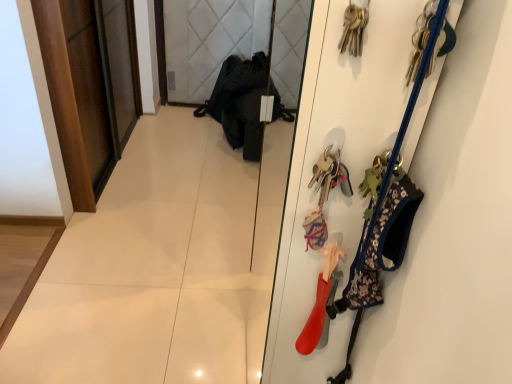
Question: From the image's perspective, is rubberized red boot at right, the first accessory positioned from the bottom, above dark wood door at left?

Choices:
 (A) no
 (B) yes

Answer: (A)

Question: Can you confirm if rubberized red boot at right, the 3th accessory positioned from the top, is thinner than dark wood door at left?

Choices:
 (A) no
 (B) yes

Answer: (B)

Question: Can you confirm if rubberized red boot at right, the 3th accessory positioned from the top, is taller than dark wood door at left?

Choices:
 (A) no
 (B) yes

Answer: (A)

Question: Is rubberized red boot at right, the first accessory positioned from the bottom, outside dark wood door at left?

Choices:
 (A) no
 (B) yes

Answer: (B)

Question: From a real-world perspective, is rubberized red boot at right, the 3th accessory positioned from the top, located beneath dark wood door at left?

Choices:
 (A) no
 (B) yes

Answer: (A)

Question: Does rubberized red boot at right, the 3th accessory positioned from the top, have a lesser height compared to dark wood door at left?

Choices:
 (A) yes
 (B) no

Answer: (A)

Question: Can you confirm if floral fabric dog harness at right, which appears as the 2th accessory when viewed from the top, is shorter than clear glass mirror at center?

Choices:
 (A) no
 (B) yes

Answer: (B)

Question: Does floral fabric dog harness at right, which appears as the 2th accessory when viewed from the top, contain clear glass mirror at center?

Choices:
 (A) no
 (B) yes

Answer: (A)

Question: Is floral fabric dog harness at right, the 2th accessory in the bottom-to-top sequence, positioned behind clear glass mirror at center?

Choices:
 (A) no
 (B) yes

Answer: (A)

Question: Can you confirm if floral fabric dog harness at right, which appears as the 2th accessory when viewed from the top, is positioned to the left of clear glass mirror at center?

Choices:
 (A) no
 (B) yes

Answer: (A)

Question: Considering the relative positions of floral fabric dog harness at right, which appears as the 2th accessory when viewed from the top, and clear glass mirror at center in the image provided, is floral fabric dog harness at right, which appears as the 2th accessory when viewed from the top, in front of clear glass mirror at center?

Choices:
 (A) yes
 (B) no

Answer: (A)

Question: Does floral fabric dog harness at right, which appears as the 2th accessory when viewed from the top, have a greater width compared to clear glass mirror at center?

Choices:
 (A) yes
 (B) no

Answer: (A)

Question: Is dark wood door at left not within rubberized red boot at right, the 3th accessory positioned from the top?

Choices:
 (A) no
 (B) yes

Answer: (B)